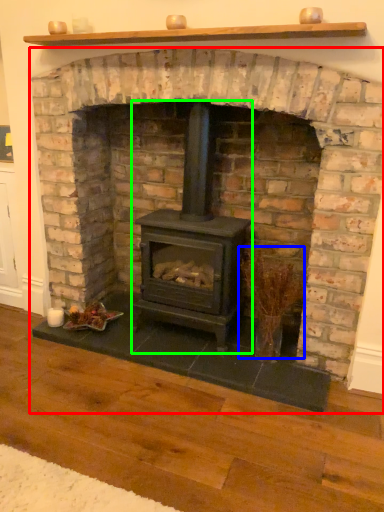
Question: Which object is positioned closest to fireplace (highlighted by a red box)? Select from twig (highlighted by a blue box) and wood burning stove (highlighted by a green box).

Choices:
 (A) twig
 (B) wood burning stove

Answer: (B)